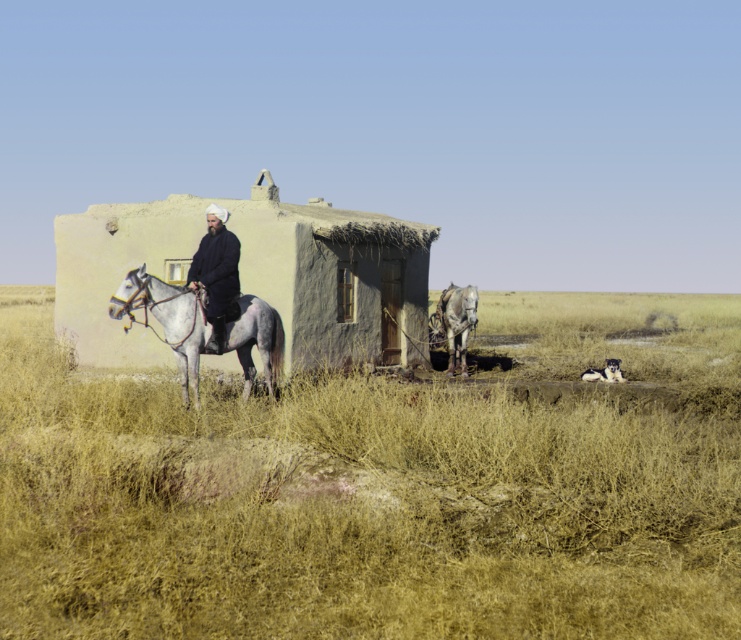
Question: Among these points, which one is farthest from the camera?

Choices:
 (A) (142, 221)
 (B) (624, 605)
 (C) (445, 291)

Answer: (C)

Question: Is light beige mudbrick hut at center positioned in front of dark blue fabric at center?

Choices:
 (A) no
 (B) yes

Answer: (A)

Question: Is light beige mudbrick hut at center further to the viewer compared to dark blue fabric at center?

Choices:
 (A) yes
 (B) no

Answer: (A)

Question: Which object is closer to the camera taking this photo?

Choices:
 (A) gray matte horse at left
 (B) dark blue fabric at center

Answer: (A)

Question: Is light beige mudbrick hut at center smaller than dark blue fabric at center?

Choices:
 (A) no
 (B) yes

Answer: (A)

Question: Which object appears farthest from the camera in this image?

Choices:
 (A) gray matte horse at left
 (B) gray matte horse at center
 (C) dry grass at center
 (D) light beige mudbrick hut at center

Answer: (B)